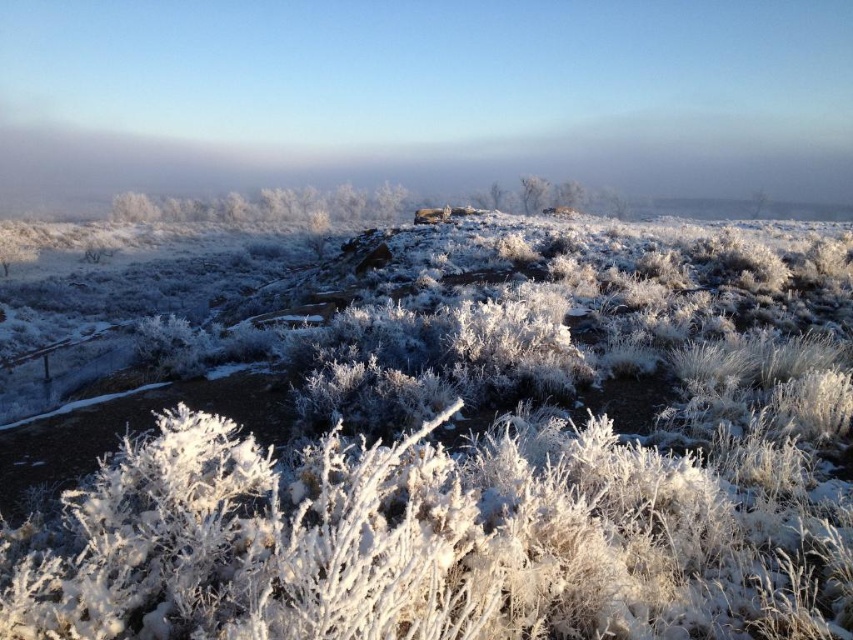
You are an animal trying to cross this winter field. You see the white frosty bush at center and the white frosty tree at center. How far apart are they?

The distance between the white frosty bush at center and the white frosty tree at center is 4.37 meters.

You are standing at the point marked as point (480, 449) in the image. What type of terrain are you currently standing on?

You are standing on frosted grass at center.